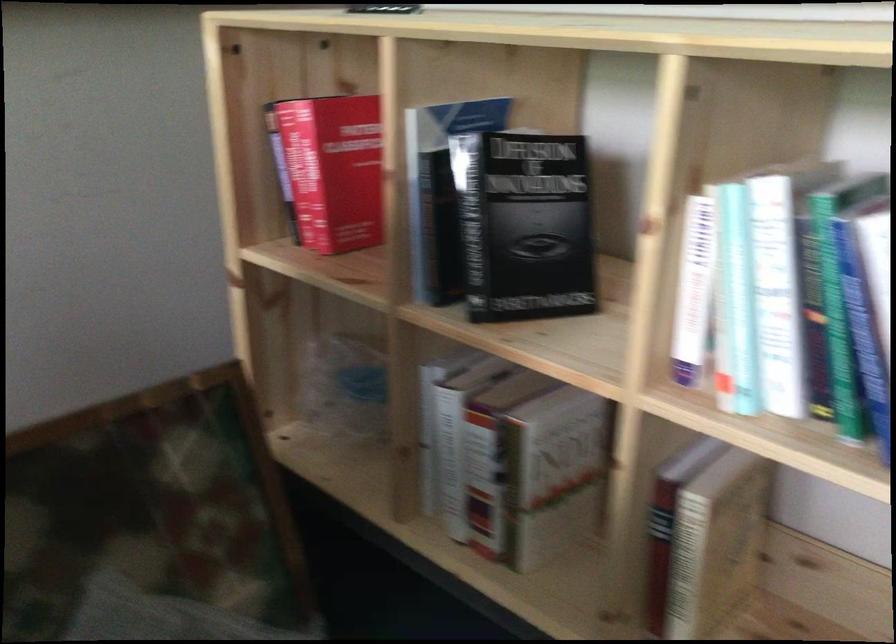
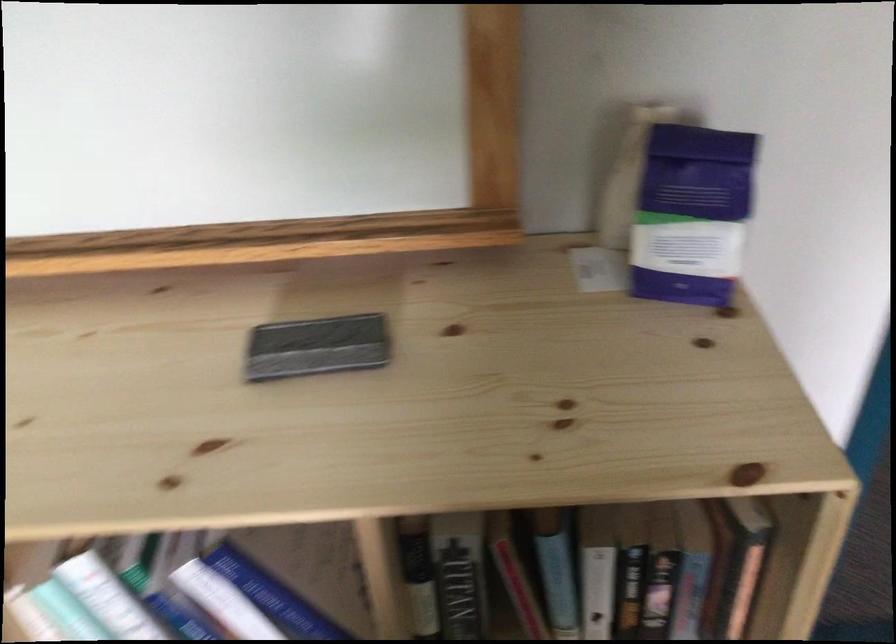
The images are taken continuously from a first-person perspective. In which direction is your viewpoint rotating?

The camera rotated toward right-down.